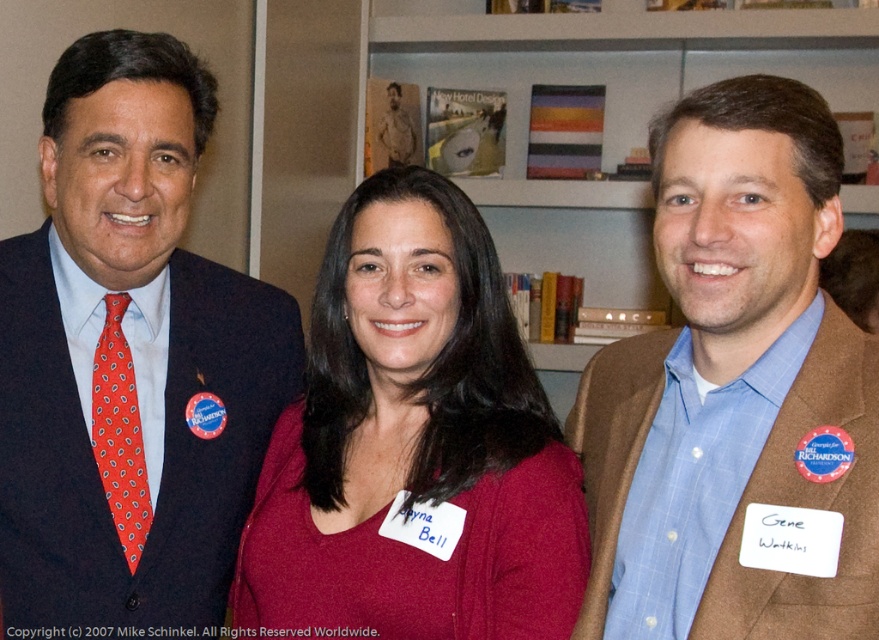
Question: Does hardcover books at upper center have a larger size compared to red dotted tie at left?

Choices:
 (A) no
 (B) yes

Answer: (B)

Question: Which of the following is the closest to the observer?

Choices:
 (A) hardcover books at upper center
 (B) red dotted tie at left

Answer: (B)

Question: Which object is the closest to the red dotted tie at left?

Choices:
 (A) brown textured blazer at center
 (B) matte black suit at left

Answer: (B)

Question: Which of the following is the farthest from the observer?

Choices:
 (A) hardcover books at upper center
 (B) brown textured blazer at center
 (C) matte red shirt at center

Answer: (A)

Question: Does matte black suit at left lie in front of red dotted tie at left?

Choices:
 (A) yes
 (B) no

Answer: (A)

Question: Is matte red shirt at center to the left of red dotted tie at left from the viewer's perspective?

Choices:
 (A) yes
 (B) no

Answer: (B)